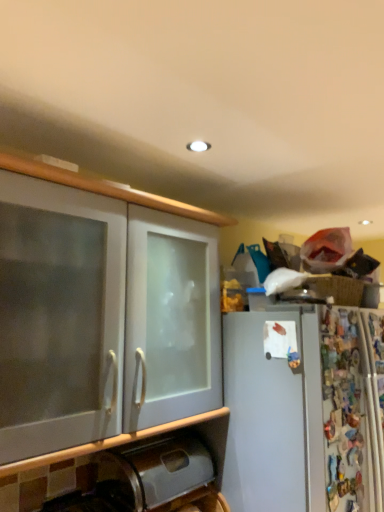
Question: In terms of height, does metallic stainless steel trash can at lower left look taller or shorter compared to white frosted glass cabinet at left?

Choices:
 (A) short
 (B) tall

Answer: (A)

Question: In terms of size, does metallic stainless steel trash can at lower left appear bigger or smaller than white frosted glass cabinet at left?

Choices:
 (A) big
 (B) small

Answer: (B)

Question: From the image's perspective, relative to white frosted glass cabinet at left, is metallic stainless steel trash can at lower left above or below?

Choices:
 (A) above
 (B) below

Answer: (B)

Question: From the image's perspective, is white frosted glass cabinet at left above or below metallic stainless steel trash can at lower left?

Choices:
 (A) above
 (B) below

Answer: (A)

Question: From a real-world perspective, is white frosted glass cabinet at left above or below metallic stainless steel trash can at lower left?

Choices:
 (A) above
 (B) below

Answer: (A)

Question: Visually, is white frosted glass cabinet at left positioned to the left or to the right of metallic stainless steel trash can at lower left?

Choices:
 (A) right
 (B) left

Answer: (B)

Question: Is point (23, 328) positioned closer to the camera than point (165, 497)?

Choices:
 (A) farther
 (B) closer

Answer: (B)